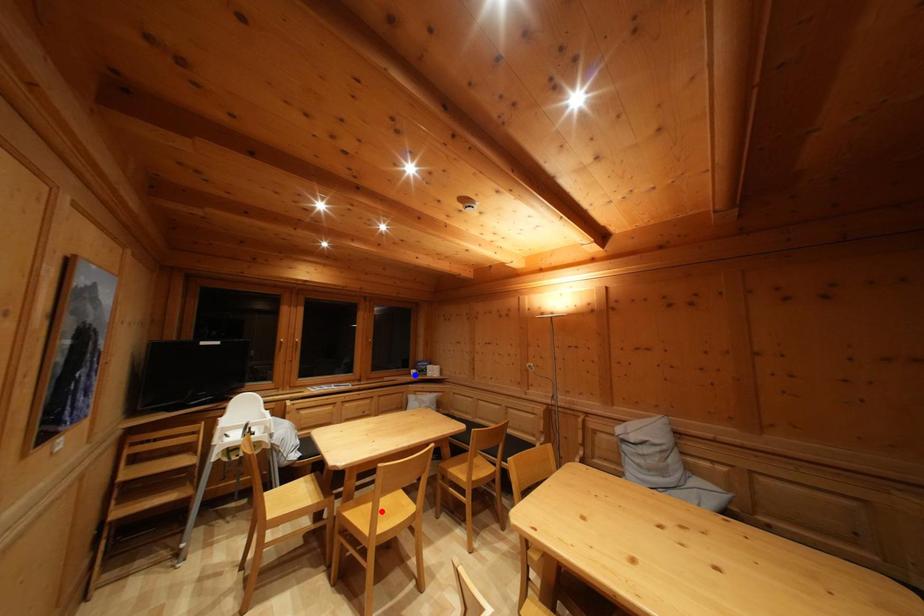
Question: Which of the two points in the image is closer to the camera?

Choices:
 (A) Blue point is closer.
 (B) Red point is closer.

Answer: (B)